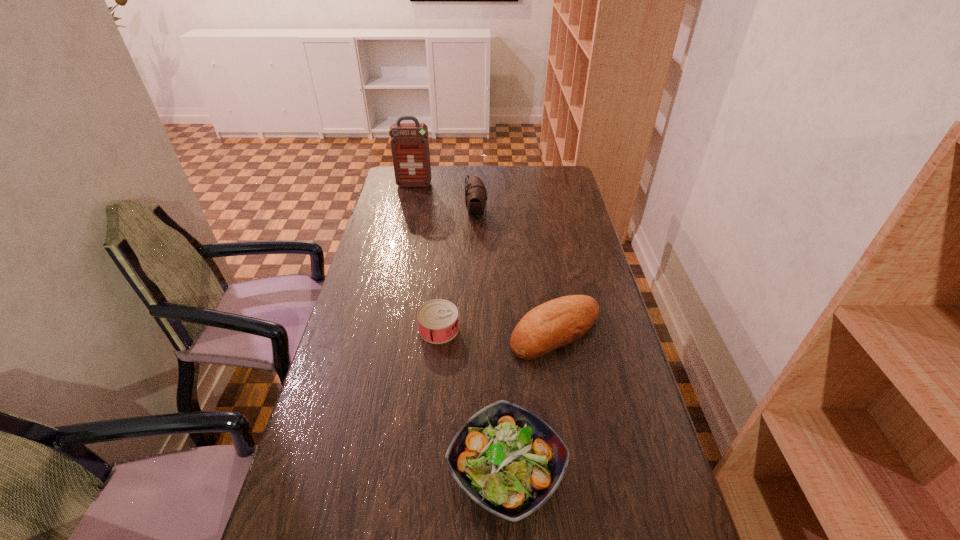
Locate an element on the screen. The image size is (960, 540). free space located on the front of the bread is located at coordinates (571, 426).

Identify the location of vacant space positioned on the back of the shortest object. This screenshot has width=960, height=540. (447, 242).

At what (x,y) coordinates should I click in order to perform the action: click on object that is at the far edge. Please return your answer as a coordinate pair (x, y). This screenshot has height=540, width=960. Looking at the image, I should click on (409, 142).

Image resolution: width=960 pixels, height=540 pixels. I want to click on object located at the left edge, so point(409,142).

Locate an element on the screen. The height and width of the screenshot is (540, 960). object at the right edge is located at coordinates (561, 321).

Identify the location of object situated at the far left corner. (409, 142).

Find the location of a particular element. The image size is (960, 540). vacant space at the far edge of the desktop is located at coordinates (441, 183).

Where is `free space at the left edge of the desktop`? The width and height of the screenshot is (960, 540). free space at the left edge of the desktop is located at coordinates (343, 445).

Locate an element on the screen. The height and width of the screenshot is (540, 960). vacant space at the right edge is located at coordinates (580, 228).

You are a GUI agent. You are given a task and a screenshot of the screen. Output one action in this format:
    pyautogui.click(x=<x>, y=<y>)
    Task: Click on the vacant area that lies between the first-aid kit and the fourth shortest object
    The width and height of the screenshot is (960, 540).
    Given the screenshot: What is the action you would take?
    pyautogui.click(x=445, y=199)